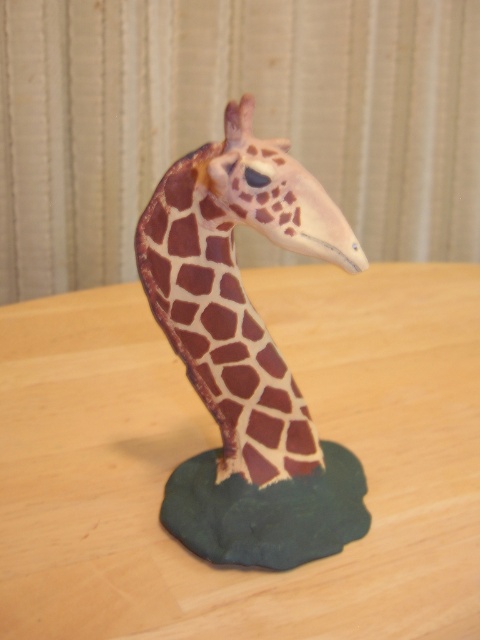
Question: Is wooden table at center thinner than matte brown giraffe at center?

Choices:
 (A) no
 (B) yes

Answer: (A)

Question: Which of the following is the farthest from the observer?

Choices:
 (A) (348, 401)
 (B) (142, 252)

Answer: (A)

Question: Is wooden table at center wider than matte brown giraffe at center?

Choices:
 (A) no
 (B) yes

Answer: (B)

Question: In this image, where is wooden table at center located relative to matte brown giraffe at center?

Choices:
 (A) above
 (B) below

Answer: (B)